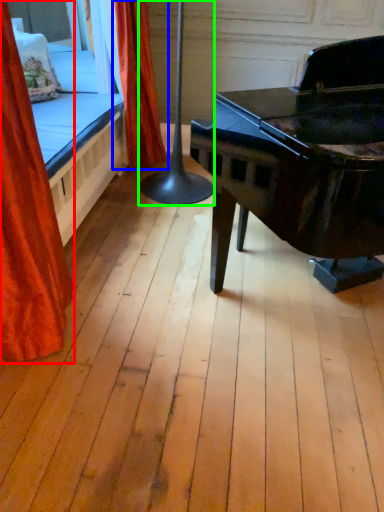
Question: Based on their relative distances, which object is farther from curtain (highlighted by a red box)? Choose from curtain (highlighted by a blue box) and table lamp (highlighted by a green box).

Choices:
 (A) curtain
 (B) table lamp

Answer: (A)